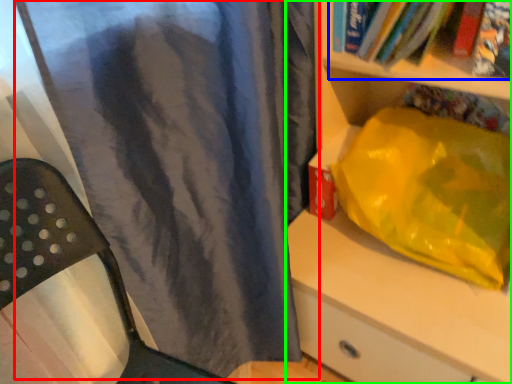
Question: Which is farther away from curtain (highlighted by a red box)? book (highlighted by a blue box) or shelf (highlighted by a green box)?

Choices:
 (A) book
 (B) shelf

Answer: (A)